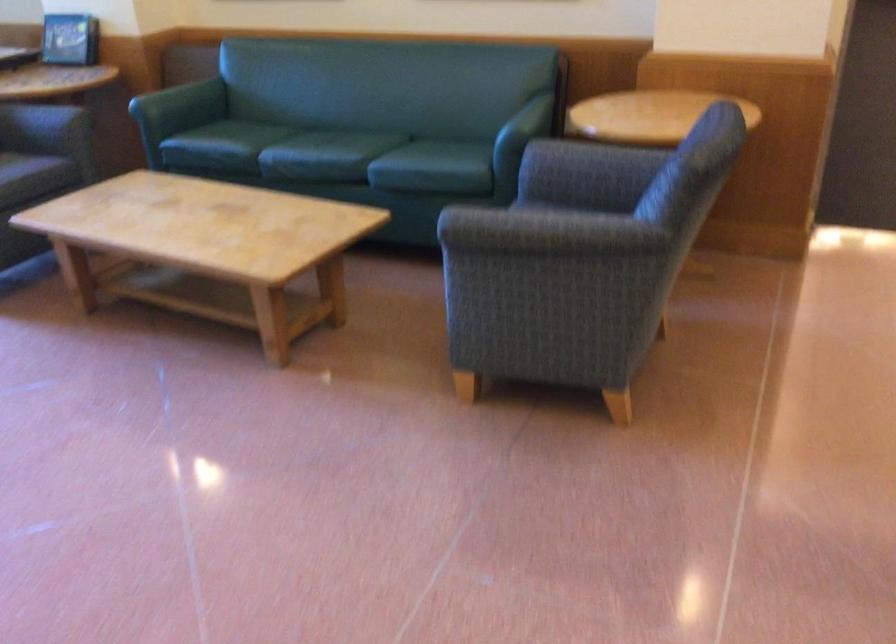
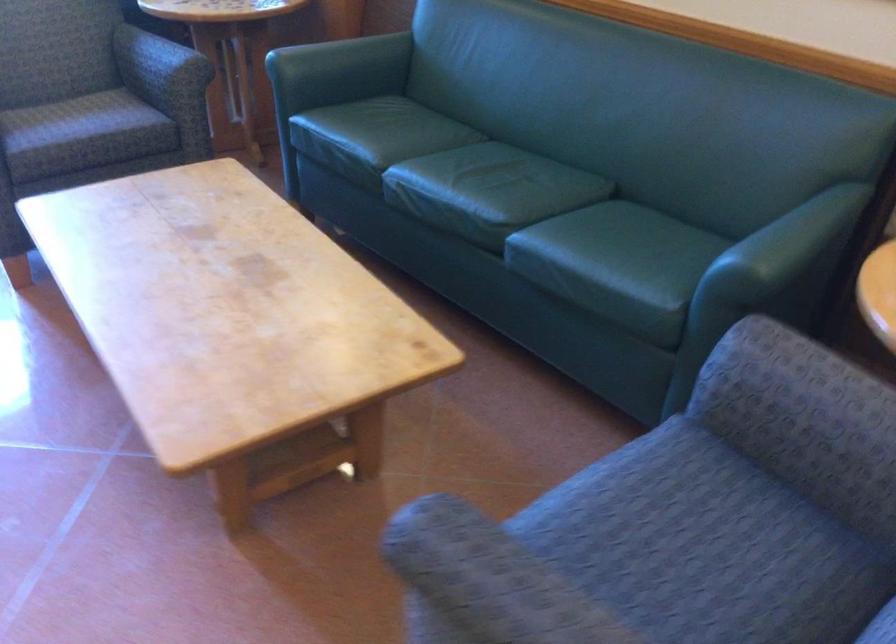
Where in the second image is the point corresponding to pixel 533 109 from the first image?

(791, 238)